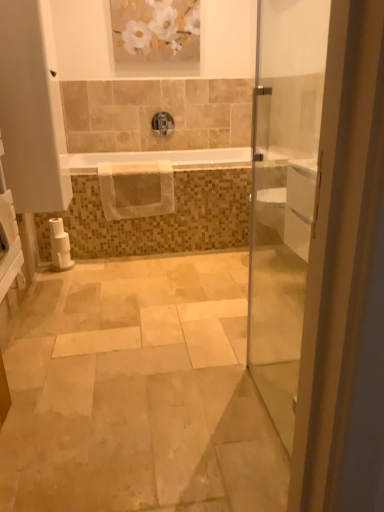
Find the location of `free space that is in between white matte toilet paper at lower left and white glossy door at right`. free space that is in between white matte toilet paper at lower left and white glossy door at right is located at coordinates (166, 336).